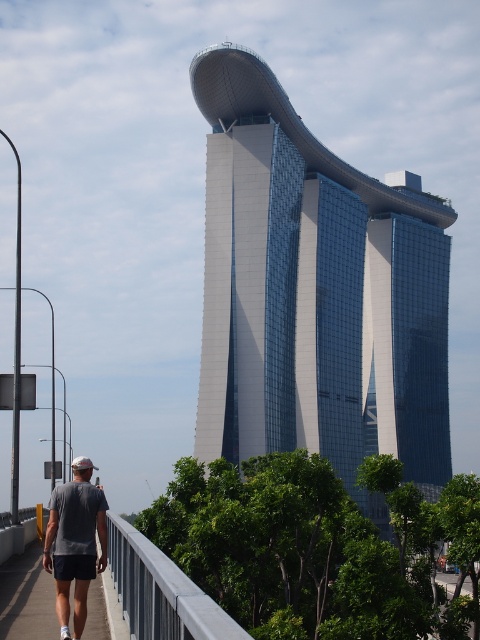
Consider the image. You are standing on the pedestrian pathway in front of the Marina Bay Sands hotel. There is a point marked at coordinates (74, 545). What object or feature does this point correspond to?

The point at coordinates (74, 545) corresponds to the gray fabric shirt at lower left.